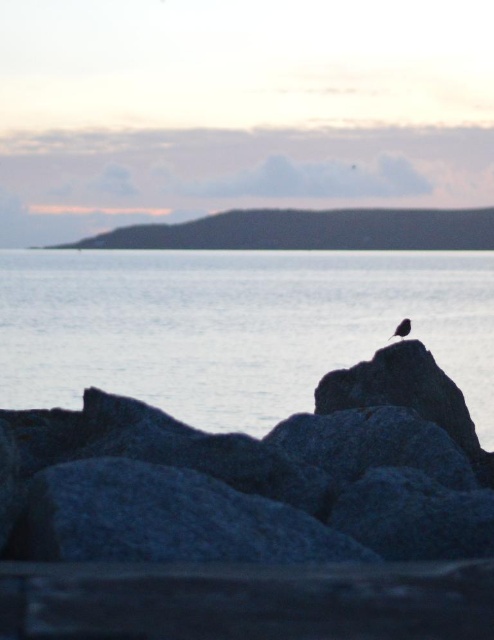
Which is more to the right, gray rough rock at center or silvery metallic bird at center?

silvery metallic bird at center is more to the right.

Is gray rough rock at center to the left of silvery metallic bird at center from the viewer's perspective?

Correct, you'll find gray rough rock at center to the left of silvery metallic bird at center.

Does point (157, 605) come farther from viewer compared to point (402, 320)?

That is False.

The image size is (494, 640). What are the coordinates of `gray rough rock at center` in the screenshot? It's located at (252, 516).

Does blue water at center have a greater width compared to silvery metallic bird at center?

Correct, the width of blue water at center exceeds that of silvery metallic bird at center.

Does blue water at center have a lesser width compared to silvery metallic bird at center?

In fact, blue water at center might be wider than silvery metallic bird at center.

Is point (423, 282) more distant than point (407, 323)?

Yes, point (423, 282) is behind point (407, 323).

Identify the location of blue water at center. (235, 326).

Which is more to the right, gray rough rock at center or blue water at center?

gray rough rock at center

Can you confirm if gray rough rock at center is taller than blue water at center?

Incorrect, gray rough rock at center's height is not larger of blue water at center's.

Locate an element on the screen. gray rough rock at center is located at coordinates (252, 516).

Identify the location of gray rough rock at center. (252, 516).